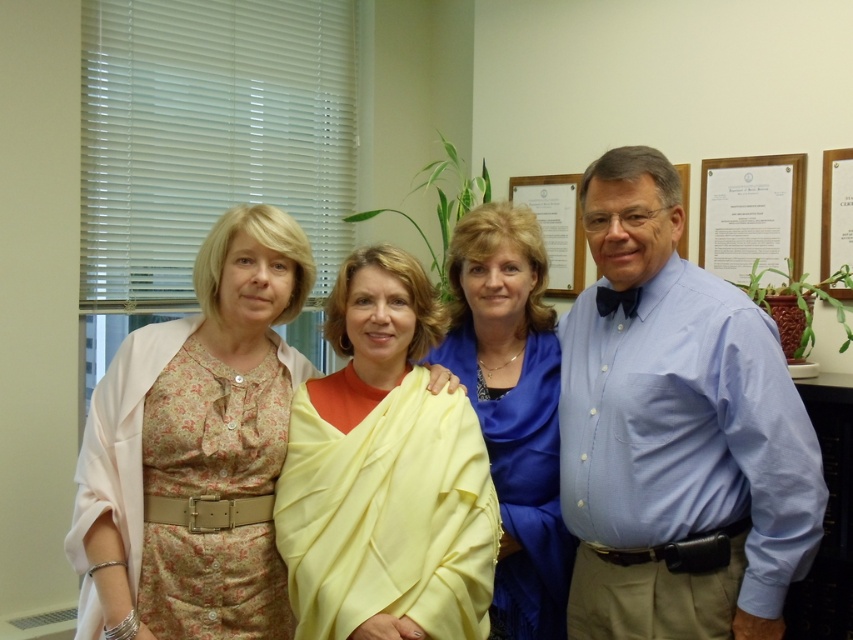
Can you confirm if floral fabric dress at left is positioned to the right of blue satin blouse at center?

Incorrect, floral fabric dress at left is not on the right side of blue satin blouse at center.

Who is more distant from viewer, (264,474) or (515,596)?

The point (515,596) is behind.

What are the coordinates of `floral fabric dress at left` in the screenshot? It's located at (x=196, y=445).

Which of these two, floral dress at left or floral fabric dress at left, stands shorter?

A: Standing shorter between the two is floral fabric dress at left.

Can you confirm if floral dress at left is positioned below floral fabric dress at left?

No.

Find the location of a particular element. Image resolution: width=853 pixels, height=640 pixels. floral dress at left is located at coordinates (677, 422).

Where is `floral dress at left`? This screenshot has height=640, width=853. floral dress at left is located at coordinates (677, 422).

From the picture: Does wooden framed document at upper right have a lesser width compared to wooden plaque at upper right?

Indeed, wooden framed document at upper right has a lesser width compared to wooden plaque at upper right.

Is wooden framed document at upper right bigger than wooden plaque at upper right?

Actually, wooden framed document at upper right might be smaller than wooden plaque at upper right.

Between point (761, 173) and point (567, 294), which one is positioned behind?

The point (567, 294) is more distant.

The height and width of the screenshot is (640, 853). Identify the location of wooden framed document at upper right. (751, 212).